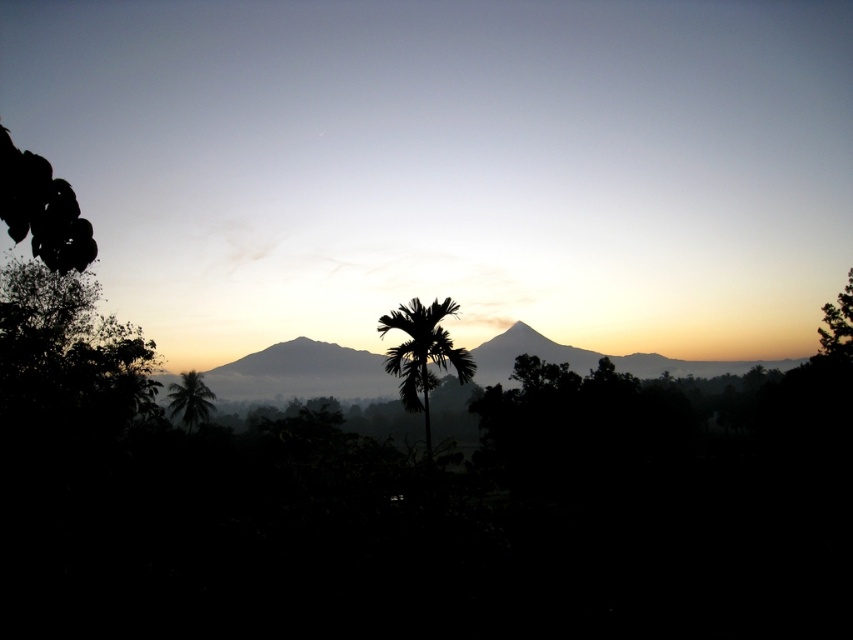
Is green leafy tree at left below green leafy palm tree at lower left?

No.

Does point (50, 314) come farther from viewer compared to point (213, 392)?

No, it is in front of (213, 392).

What are the coordinates of `green leafy tree at left` in the screenshot? It's located at (68, 355).

Is green leafy tree at left above green leafy palm at center?

Yes.

Who is higher up, green leafy tree at left or green leafy palm at center?

green leafy tree at left

Locate an element on the screen. This screenshot has width=853, height=640. green leafy tree at left is located at coordinates (68, 355).

Is green leafy tree at left bigger than green leafy tree at right?

Indeed, green leafy tree at left has a larger size compared to green leafy tree at right.

Between green leafy tree at left and green leafy tree at right, which one appears on the left side from the viewer's perspective?

Positioned to the left is green leafy tree at left.

Locate an element on the screen. green leafy tree at left is located at coordinates (68, 355).

Identify the location of green leafy tree at left. The height and width of the screenshot is (640, 853). (68, 355).